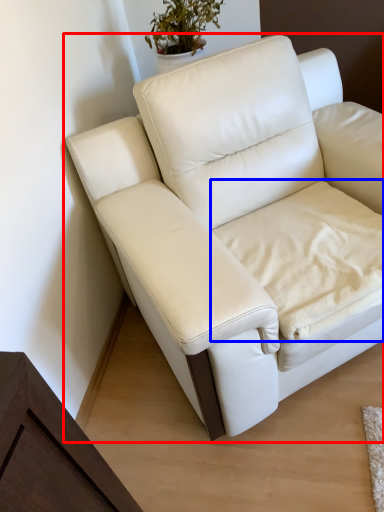
Question: Which object appears farthest to the camera in this image, studio couch (highlighted by a red box) or sheet (highlighted by a blue box)?

Choices:
 (A) studio couch
 (B) sheet

Answer: (B)